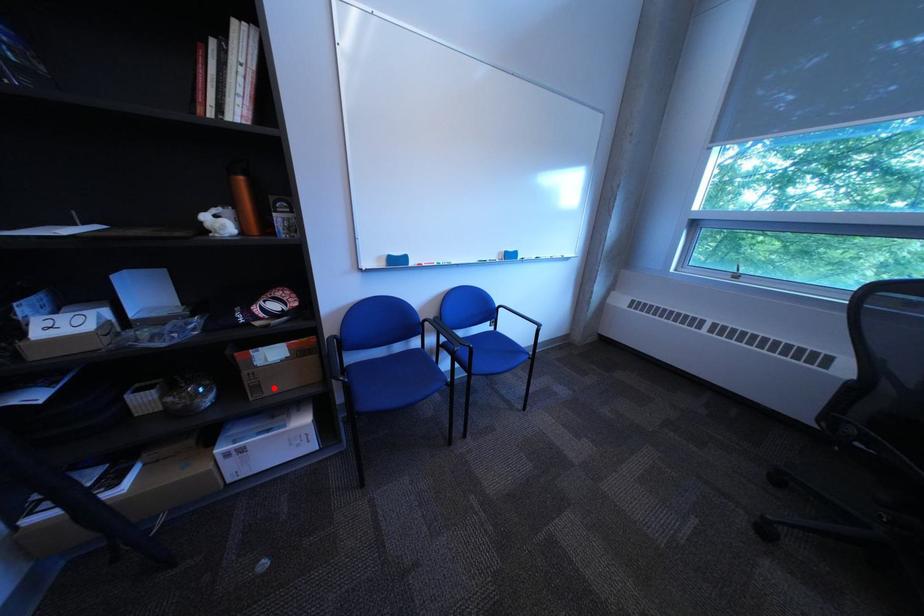
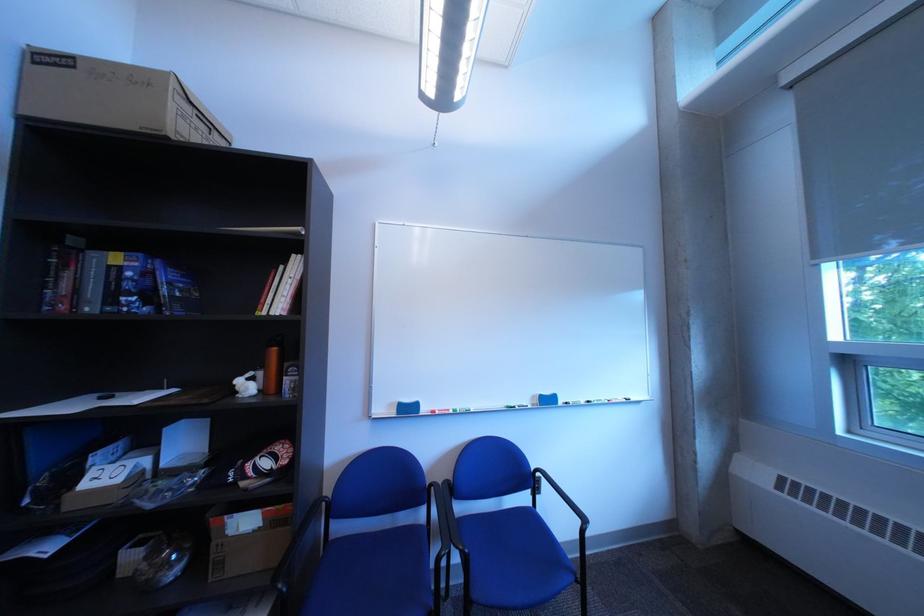
Where in the second image is the point corresponding to the highlighted location from the first image?

(237, 565)